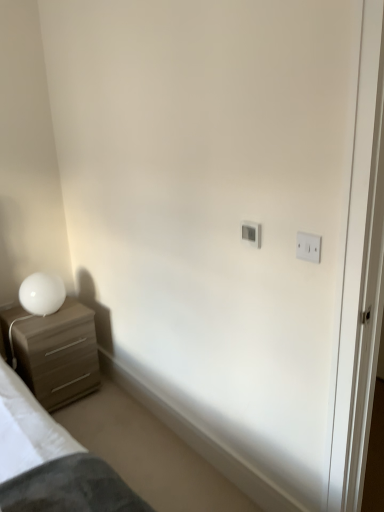
Locate an element on the screen. Image resolution: width=384 pixels, height=512 pixels. white glossy table lamp at lower left is located at coordinates (42, 293).

Describe the element at coordinates (42, 293) in the screenshot. The image size is (384, 512). I see `white glossy table lamp at lower left` at that location.

Locate an element on the screen. white plastic light switch at upper right, which is the 1th light switch from right to left is located at coordinates (308, 247).

This screenshot has height=512, width=384. What are the coordinates of `white plastic light switch at upper center, acting as the 2th light switch starting from the right` in the screenshot? It's located at (251, 233).

Locate an element on the screen. The height and width of the screenshot is (512, 384). white glossy table lamp at lower left is located at coordinates (42, 293).

Which of these two, matte wood chest of drawers at left or white plastic light switch at upper center, acting as the 2th light switch starting from the right, stands shorter?

With less height is white plastic light switch at upper center, acting as the 2th light switch starting from the right.

Locate an element on the screen. chest of drawers lying on the left of white plastic light switch at upper center, the second light switch when ordered from front to back is located at coordinates (55, 352).

Does matte wood chest of drawers at left have a smaller size compared to white plastic light switch at upper center, marked as the first light switch in a left-to-right arrangement?

Actually, matte wood chest of drawers at left might be larger than white plastic light switch at upper center, marked as the first light switch in a left-to-right arrangement.

Can you tell me how much matte wood chest of drawers at left and white plastic light switch at upper center, marked as the first light switch in a left-to-right arrangement, differ in facing direction?

The angular difference between matte wood chest of drawers at left and white plastic light switch at upper center, marked as the first light switch in a left-to-right arrangement, is 91.5 degrees.

Can you confirm if white glossy table lamp at lower left is positioned to the left of white plastic light switch at upper right, positioned as the 2th light switch in back-to-front order?

Correct, you'll find white glossy table lamp at lower left to the left of white plastic light switch at upper right, positioned as the 2th light switch in back-to-front order.

From a real-world perspective, is white glossy table lamp at lower left above or below white plastic light switch at upper right, positioned as the 2th light switch in back-to-front order?

white glossy table lamp at lower left is situated lower than white plastic light switch at upper right, positioned as the 2th light switch in back-to-front order, in the real world.

Which object is more forward, white glossy table lamp at lower left or white plastic light switch at upper right, positioned as the 2th light switch in back-to-front order?

white plastic light switch at upper right, positioned as the 2th light switch in back-to-front order, is more forward.

Is white glossy table lamp at lower left taller than matte wood chest of drawers at left?

In fact, white glossy table lamp at lower left may be shorter than matte wood chest of drawers at left.

In the scene shown: Considering the sizes of objects white glossy table lamp at lower left and matte wood chest of drawers at left in the image provided, who is wider, white glossy table lamp at lower left or matte wood chest of drawers at left?

With larger width is matte wood chest of drawers at left.

From a real-world perspective, which object stands above the other?

From a 3D spatial view, white glossy table lamp at lower left is above.

Considering the sizes of white glossy table lamp at lower left and matte wood chest of drawers at left in the image, is white glossy table lamp at lower left bigger or smaller than matte wood chest of drawers at left?

Considering their sizes, white glossy table lamp at lower left takes up less space than matte wood chest of drawers at left.

From a real-world perspective, is white plastic light switch at upper center, acting as the 2th light switch starting from the right, beneath white glossy table lamp at lower left?

No, from a real-world perspective, white plastic light switch at upper center, acting as the 2th light switch starting from the right, is not below white glossy table lamp at lower left.

In the scene shown: Can white glossy table lamp at lower left be found inside white plastic light switch at upper center, acting as the 2th light switch starting from the right?

Actually, white glossy table lamp at lower left is outside white plastic light switch at upper center, acting as the 2th light switch starting from the right.

Considering the relative sizes of white plastic light switch at upper center, the 1th light switch viewed from the back, and white glossy table lamp at lower left in the image provided, is white plastic light switch at upper center, the 1th light switch viewed from the back, bigger than white glossy table lamp at lower left?

No, white plastic light switch at upper center, the 1th light switch viewed from the back, is not bigger than white glossy table lamp at lower left.

In the image, is white plastic light switch at upper center, marked as the first light switch in a left-to-right arrangement, positioned in front of or behind white glossy table lamp at lower left?

Clearly, white plastic light switch at upper center, marked as the first light switch in a left-to-right arrangement, is in front of white glossy table lamp at lower left.

Between white plastic light switch at upper right, which is the 1th light switch from right to left, and matte wood chest of drawers at left, which one appears on the left side from the viewer's perspective?

matte wood chest of drawers at left is more to the left.

Does point (319, 238) come closer to viewer compared to point (40, 365)?

Yes, it is in front of point (40, 365).

Which light switch is the 2nd one when counting from the front of the matte wood chest of drawers at left? Please provide its 2D coordinates.

[(308, 247)]

How many degrees apart are the facing directions of white plastic light switch at upper right, which is the second light switch in left-to-right order, and matte wood chest of drawers at left?

There is a 91.5-degree angle between the facing directions of white plastic light switch at upper right, which is the second light switch in left-to-right order, and matte wood chest of drawers at left.

Would you consider matte wood chest of drawers at left to be distant from white plastic light switch at upper right, positioned as the 2th light switch in back-to-front order?

Absolutely, matte wood chest of drawers at left is distant from white plastic light switch at upper right, positioned as the 2th light switch in back-to-front order.

Is the depth of matte wood chest of drawers at left greater than that of white plastic light switch at upper right, placed as the first light switch when sorted from front to back?

That is True.

From a real-world perspective, who is located higher, matte wood chest of drawers at left or white plastic light switch at upper right, which is the second light switch in left-to-right order?

From a 3D spatial view, white plastic light switch at upper right, which is the second light switch in left-to-right order, is above.

Is white plastic light switch at upper center, the 1th light switch viewed from the back, facing towards matte wood chest of drawers at left?

No, white plastic light switch at upper center, the 1th light switch viewed from the back, is not aimed at matte wood chest of drawers at left.

How many degrees apart are the facing directions of white plastic light switch at upper center, the 1th light switch viewed from the back, and matte wood chest of drawers at left?

91.5 degrees separate the facing orientations of white plastic light switch at upper center, the 1th light switch viewed from the back, and matte wood chest of drawers at left.

Does white plastic light switch at upper center, marked as the first light switch in a left-to-right arrangement, come behind matte wood chest of drawers at left?

No, it is in front of matte wood chest of drawers at left.

Between white plastic light switch at upper center, the 1th light switch viewed from the back, and matte wood chest of drawers at left, which one has larger size?

matte wood chest of drawers at left.

Where is `chest of drawers below the white plastic light switch at upper center, acting as the 2th light switch starting from the right (from the image's perspective)`? The image size is (384, 512). chest of drawers below the white plastic light switch at upper center, acting as the 2th light switch starting from the right (from the image's perspective) is located at coordinates (55, 352).

The width and height of the screenshot is (384, 512). I want to click on table lamp below the white plastic light switch at upper right, positioned as the 2th light switch in back-to-front order (from a real-world perspective), so (42, 293).

In the scene shown: Which object lies further to the anchor point matte wood chest of drawers at left, white glossy table lamp at lower left or white plastic light switch at upper center, the second light switch when ordered from front to back?

white plastic light switch at upper center, the second light switch when ordered from front to back, is further to matte wood chest of drawers at left.

Based on their spatial positions, is white glossy table lamp at lower left or white plastic light switch at upper center, marked as the first light switch in a left-to-right arrangement, further from white plastic light switch at upper right, placed as the first light switch when sorted from front to back?

white glossy table lamp at lower left is positioned further to the anchor white plastic light switch at upper right, placed as the first light switch when sorted from front to back.

Considering their positions, is white glossy table lamp at lower left positioned closer to matte wood chest of drawers at left than white plastic light switch at upper right, placed as the first light switch when sorted from front to back?

white glossy table lamp at lower left.

Based on their spatial positions, is white glossy table lamp at lower left or matte wood chest of drawers at left further from white plastic light switch at upper center, marked as the first light switch in a left-to-right arrangement?

Among the two, matte wood chest of drawers at left is located further to white plastic light switch at upper center, marked as the first light switch in a left-to-right arrangement.

When comparing their distances from white glossy table lamp at lower left, does white plastic light switch at upper right, which is the second light switch in left-to-right order, or white plastic light switch at upper center, marked as the first light switch in a left-to-right arrangement, seem further?

white plastic light switch at upper right, which is the second light switch in left-to-right order.

When comparing their distances from matte wood chest of drawers at left, does white plastic light switch at upper right, which is the 1th light switch from right to left, or white plastic light switch at upper center, marked as the first light switch in a left-to-right arrangement, seem further?

white plastic light switch at upper right, which is the 1th light switch from right to left.

Estimate the real-world distances between objects in this image. Which object is further from white plastic light switch at upper right, which is the 1th light switch from right to left, white glossy table lamp at lower left or matte wood chest of drawers at left?

matte wood chest of drawers at left is further to white plastic light switch at upper right, which is the 1th light switch from right to left.

Based on their spatial positions, is white plastic light switch at upper center, the second light switch when ordered from front to back, or white glossy table lamp at lower left closer to matte wood chest of drawers at left?

The object closer to matte wood chest of drawers at left is white glossy table lamp at lower left.

Locate an element on the screen. light switch between matte wood chest of drawers at left and white plastic light switch at upper right, which is the second light switch in left-to-right order is located at coordinates (251, 233).

You are a GUI agent. You are given a task and a screenshot of the screen. Output one action in this format:
    pyautogui.click(x=<x>, y=<y>)
    Task: Click on the chest of drawers situated between white glossy table lamp at lower left and white plastic light switch at upper center, acting as the 2th light switch starting from the right, from left to right
    
    Given the screenshot: What is the action you would take?
    point(55,352)

This screenshot has width=384, height=512. I want to click on the chest of drawers situated between white glossy table lamp at lower left and white plastic light switch at upper right, which is the second light switch in left-to-right order, from left to right, so click(x=55, y=352).

Image resolution: width=384 pixels, height=512 pixels. In order to click on light switch located between white glossy table lamp at lower left and white plastic light switch at upper right, positioned as the 2th light switch in back-to-front order, in the left-right direction in this screenshot , I will do `click(251, 233)`.